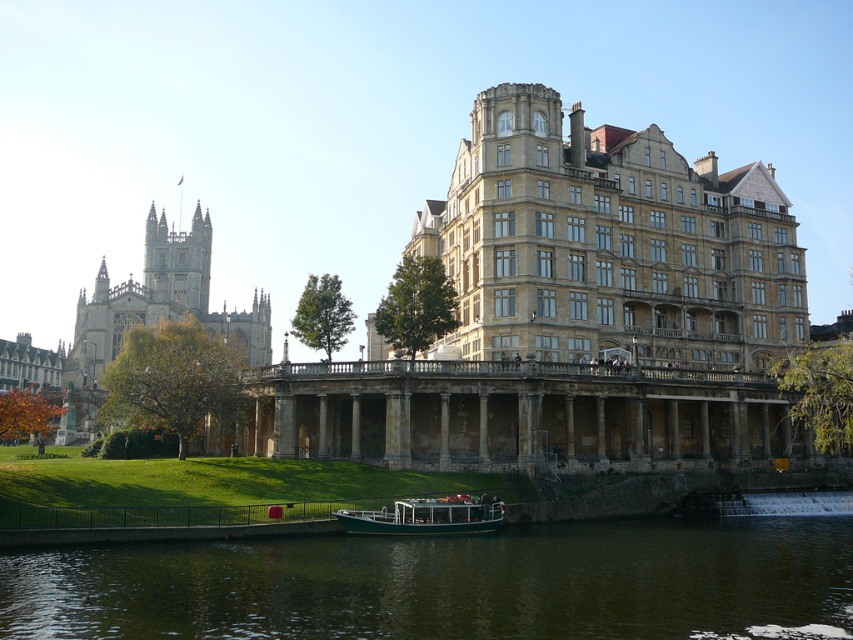
Looking at this image, which is more to the right, green water at lower center or green polished wood boat at lower center?

Positioned to the right is green water at lower center.

Between green water at lower center and green polished wood boat at lower center, which one has more height?

With more height is green water at lower center.

Who is more distant from viewer, (339, 556) or (451, 524)?

The point (451, 524) is behind.

Find the location of a particular element. The width and height of the screenshot is (853, 640). green water at lower center is located at coordinates (451, 582).